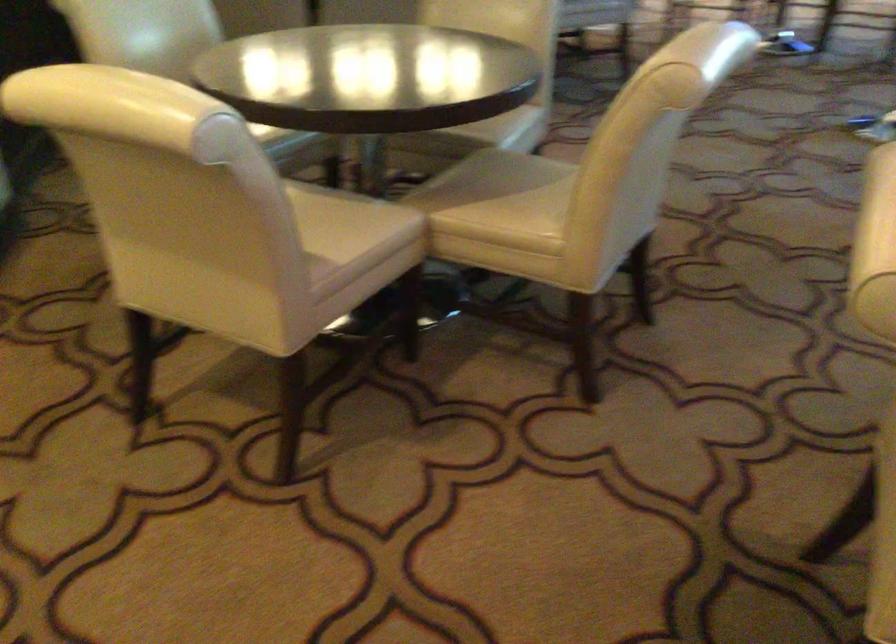
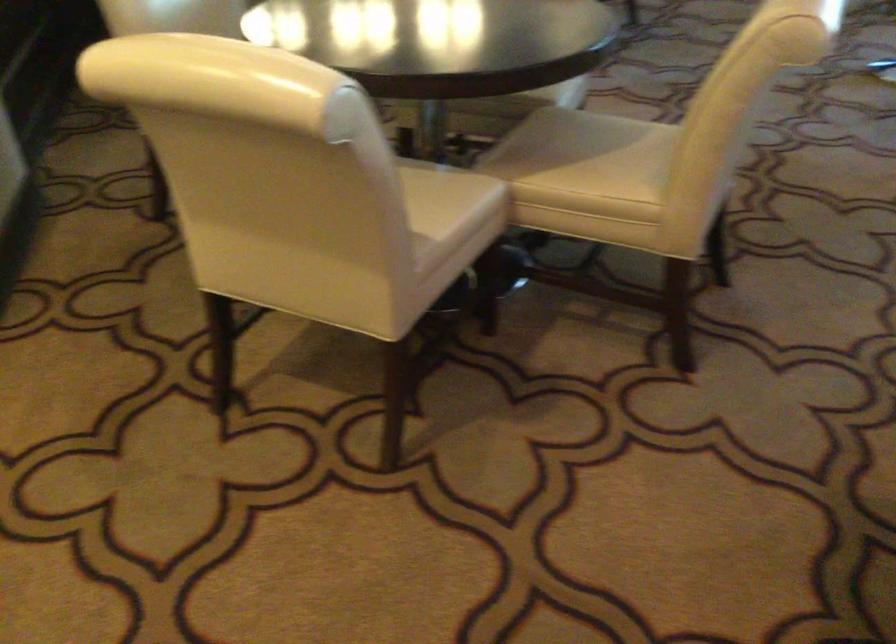
Which direction would the cameraman need to move to produce the second image?

The movement direction of the cameraman is left, forward.